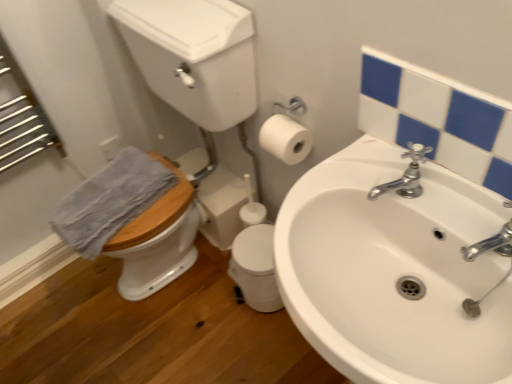
Question: From their relative heights in the image, would you say white matte toilet paper at upper right is taller or shorter than silver metallic faucet at upper right?

Choices:
 (A) short
 (B) tall

Answer: (B)

Question: From a real-world perspective, is white matte toilet paper at upper right physically located above or below silver metallic faucet at upper right?

Choices:
 (A) below
 (B) above

Answer: (A)

Question: Estimate the real-world distances between objects in this image. Which object is farther from the silver metallic faucet at upper right?

Choices:
 (A) white ceramic sink at center
 (B) wooden at left
 (C) blue textured towel at left
 (D) white glossy mirror at upper right
 (E) white matte toilet paper at upper right

Answer: (C)

Question: Considering the real-world distances, which object is farthest from the white matte toilet paper at upper right?

Choices:
 (A) silver metallic faucet at upper right
 (B) white ceramic sink at center
 (C) wooden at left
 (D) blue textured towel at left
 (E) white glossy mirror at upper right

Answer: (D)